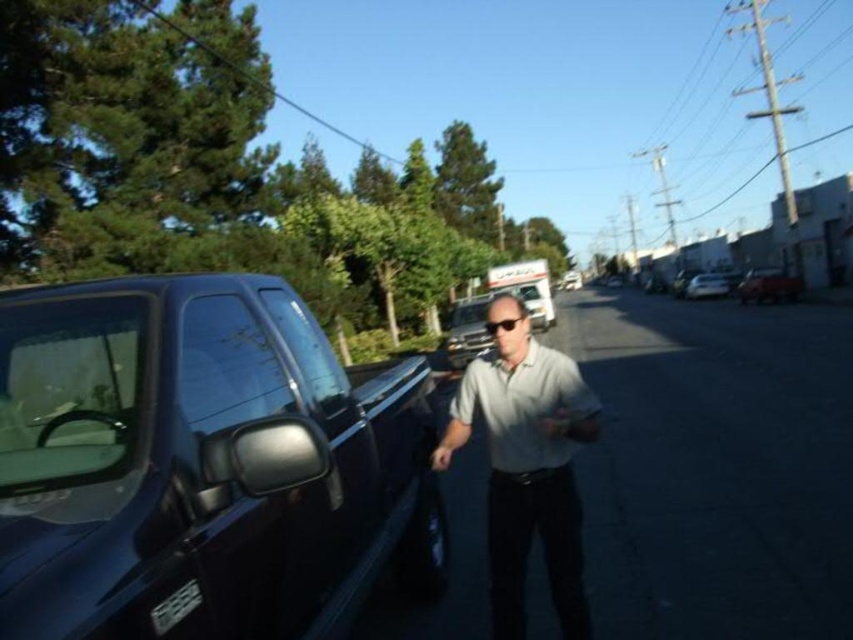
Question: Where is glossy black truck at left located in relation to gray cotton shirt at center in the image?

Choices:
 (A) above
 (B) below

Answer: (B)

Question: Is glossy black truck at left further to the viewer compared to metallic red truck at center-right?

Choices:
 (A) yes
 (B) no

Answer: (B)

Question: Is glossy black truck at left thinner than gray cotton shirt at center?

Choices:
 (A) no
 (B) yes

Answer: (A)

Question: Which of the following is the closest to the observer?

Choices:
 (A) gray cotton shirt at center
 (B) glossy black truck at left
 (C) metallic silver truck at center
 (D) metallic red truck at center-right

Answer: (B)

Question: Which of the following is the closest to the observer?

Choices:
 (A) (692, 284)
 (B) (198, 625)
 (C) (468, 353)
 (D) (541, 292)

Answer: (B)

Question: Which point is farther to the camera?

Choices:
 (A) (779, 284)
 (B) (543, 317)
 (C) (706, 296)
 (D) (445, 349)

Answer: (C)